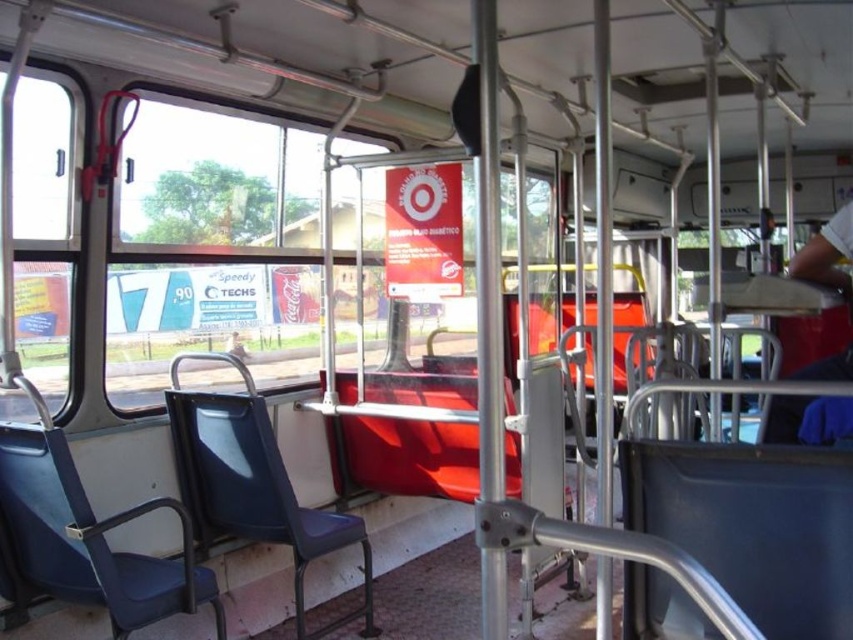
Question: Among these objects, which one is farthest from the camera?

Choices:
 (A) transparent glass window at center
 (B) matte blue plastic chair at lower left

Answer: (A)

Question: Is transparent glass window at center wider than matte blue plastic chair at lower left?

Choices:
 (A) yes
 (B) no

Answer: (B)

Question: Estimate the real-world distances between objects in this image. Which object is closer to the white fabric shirt at right?

Choices:
 (A) blue plastic chair at lower right
 (B) matte blue plastic chair at lower left
 (C) blue fabric chair at left
 (D) transparent glass window at center

Answer: (A)

Question: Where is matte blue plastic chair at lower left located in relation to white fabric shirt at right in the image?

Choices:
 (A) left
 (B) right

Answer: (A)

Question: Among these objects, which one is nearest to the camera?

Choices:
 (A) blue plastic chair at lower right
 (B) white fabric shirt at right
 (C) blue fabric chair at left

Answer: (A)

Question: Is blue fabric chair at left to the right of matte blue plastic chair at lower left from the viewer's perspective?

Choices:
 (A) yes
 (B) no

Answer: (B)